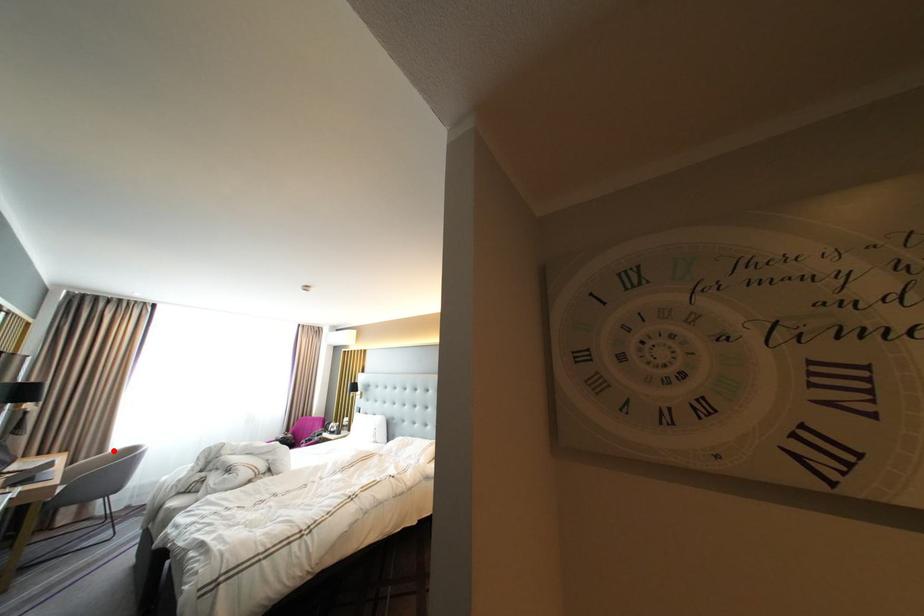
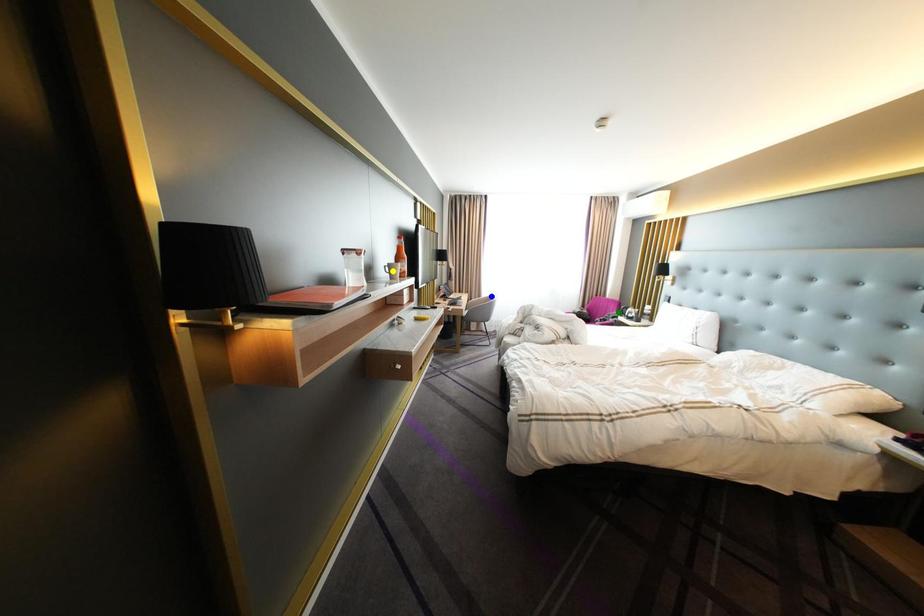
Question: I am providing you with two images of the same scene from different viewpoints. A red point is marked on the first image. You are given multiple points on the second image. Which point in image 2 is actually the same real-world point as the red point in image 1?

Choices:
 (A) yellow point
 (B) green point
 (C) blue point

Answer: (C)